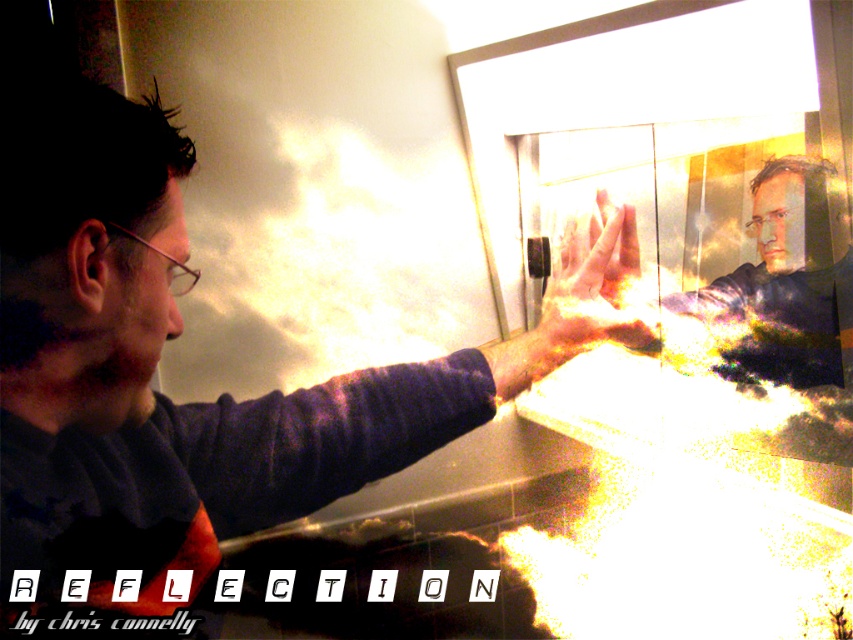
The height and width of the screenshot is (640, 853). Describe the element at coordinates (167, 397) in the screenshot. I see `matte black hand at center` at that location.

Can you confirm if matte black hand at center is positioned below translucent glass hand at center?

Yes, matte black hand at center is below translucent glass hand at center.

Image resolution: width=853 pixels, height=640 pixels. In order to click on matte black hand at center in this screenshot , I will do `click(167, 397)`.

Is matte black hand at center smaller than matte black face at upper right?

Correct, matte black hand at center occupies less space than matte black face at upper right.

Between matte black hand at center and matte black face at upper right, which one appears on the left side from the viewer's perspective?

Positioned to the left is matte black hand at center.

At what (x,y) coordinates should I click in order to perform the action: click on matte black hand at center. Please return your answer as a coordinate pair (x, y). The image size is (853, 640). Looking at the image, I should click on (167, 397).

Identify the location of matte black hand at center. The image size is (853, 640). (167, 397).

Is matte black face at upper right below translucent glass hand at center?

Yes, matte black face at upper right is below translucent glass hand at center.

Describe the element at coordinates (773, 291) in the screenshot. I see `matte black face at upper right` at that location.

Locate an element on the screen. Image resolution: width=853 pixels, height=640 pixels. matte black face at upper right is located at coordinates (773, 291).